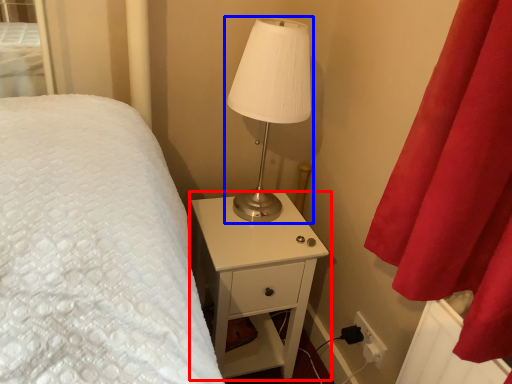
Question: Among these objects, which one is farthest to the camera, nightstand (highlighted by a red box) or lamp (highlighted by a blue box)?

Choices:
 (A) nightstand
 (B) lamp

Answer: (A)